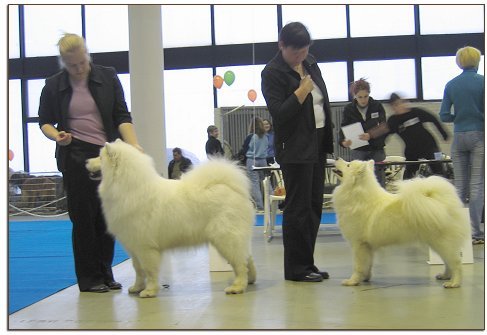
This screenshot has width=487, height=335. Find the location of `windows`. windows is located at coordinates (244, 24).